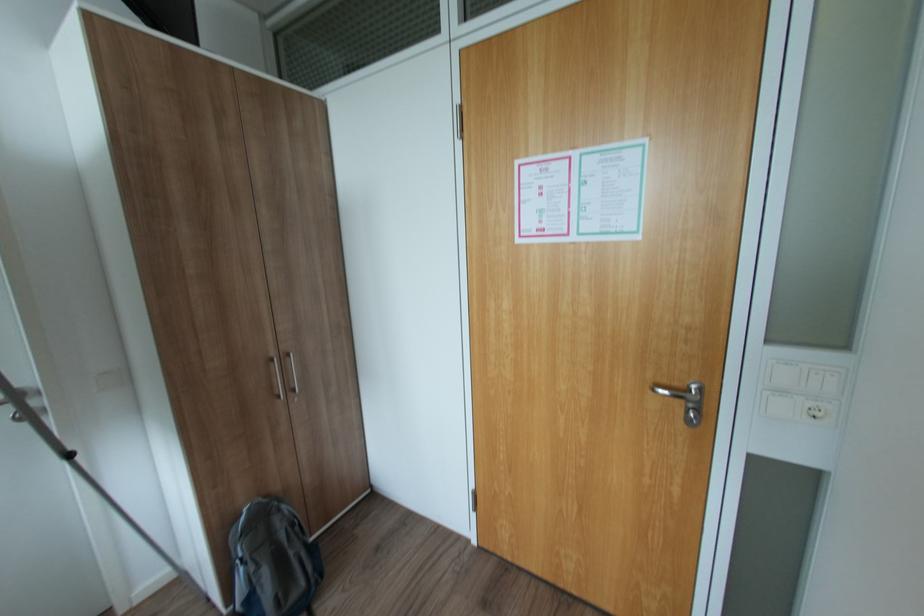
Where would you lift the grey backpack? Please return your answer as a coordinate pair (x, y).

(273, 560)